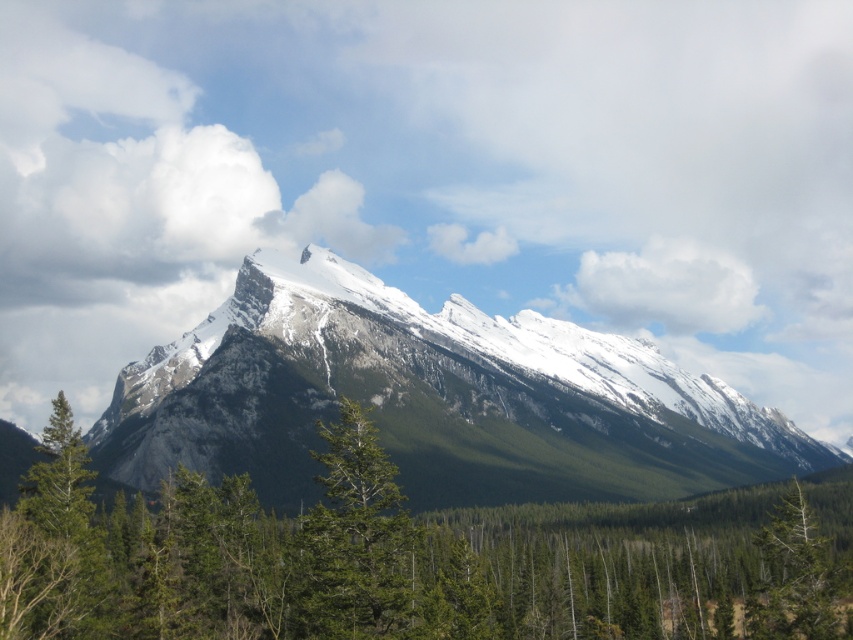
Question: Is green leafy tree at center smaller than green matte tree at center?

Choices:
 (A) yes
 (B) no

Answer: (B)

Question: Which point is farther to the camera?

Choices:
 (A) green matte tree at lower right
 (B) green matte tree at center

Answer: (A)

Question: Can you confirm if snowy granite mountain range at center is positioned to the right of white fluffy cloud at upper center?

Choices:
 (A) no
 (B) yes

Answer: (A)

Question: Which point is farther to the camera?

Choices:
 (A) (334, 618)
 (B) (402, 376)

Answer: (B)

Question: Does snowy granite mountain range at center come in front of green matte tree at left?

Choices:
 (A) yes
 (B) no

Answer: (B)

Question: Estimate the real-world distances between objects in this image. Which object is closer to the green matte tree at left?

Choices:
 (A) green matte tree at lower right
 (B) snowy granite mountain range at center
 (C) green leafy tree at center
 (D) white fluffy cloud at upper center

Answer: (C)